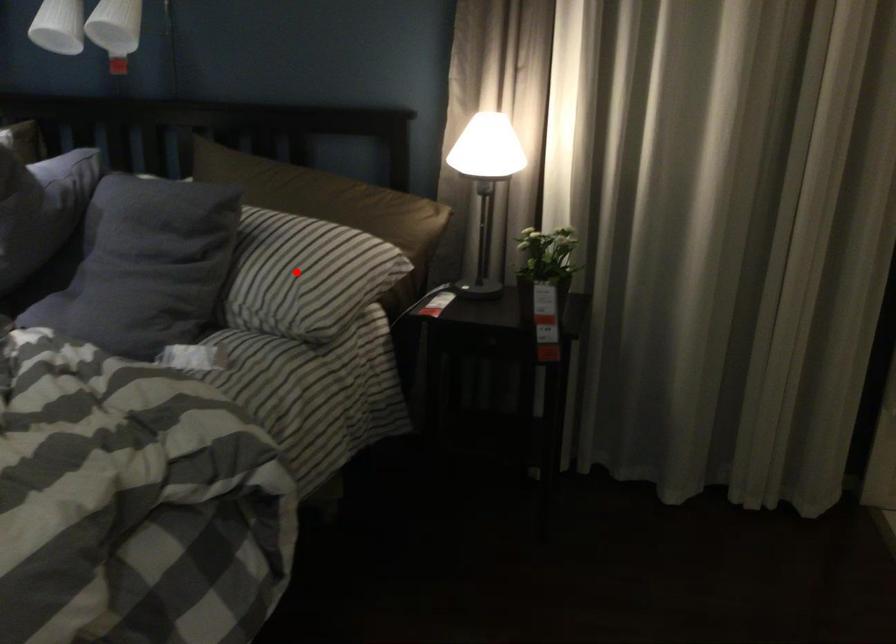
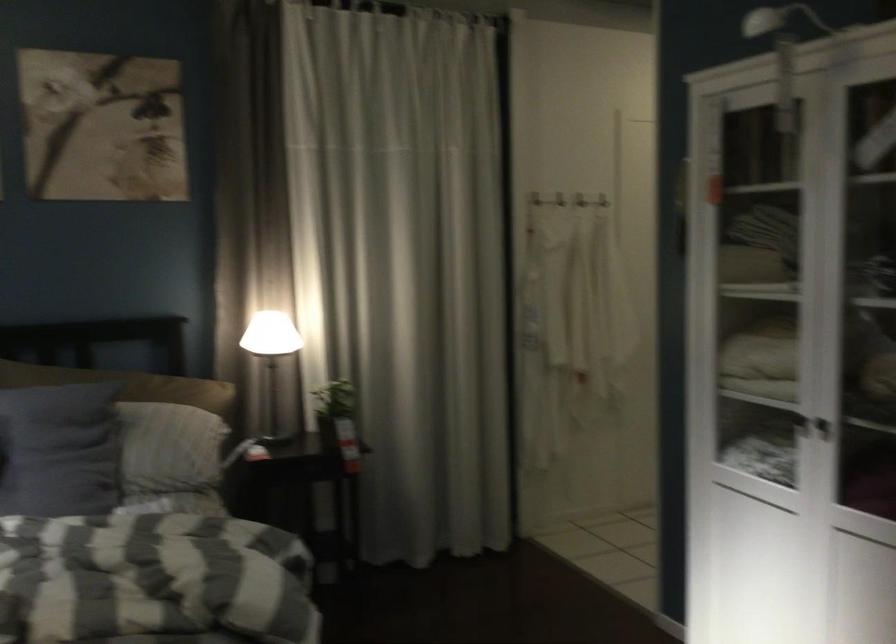
Question: I am providing you with two images of the same scene from different viewpoints. A red point is shown in image1. For the corresponding object point in image2, is it positioned nearer or farther from the camera?

Choices:
 (A) Nearer
 (B) Farther

Answer: (B)